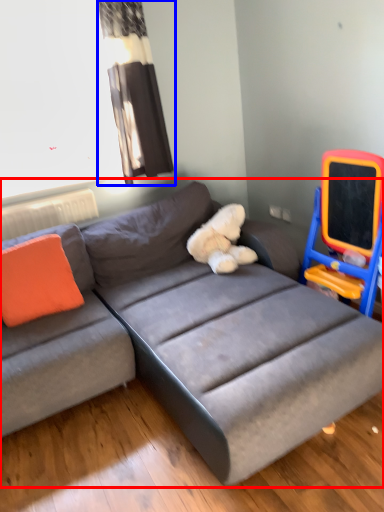
Question: Among these objects, which one is farthest to the camera, studio couch (highlighted by a red box) or curtain (highlighted by a blue box)?

Choices:
 (A) studio couch
 (B) curtain

Answer: (B)